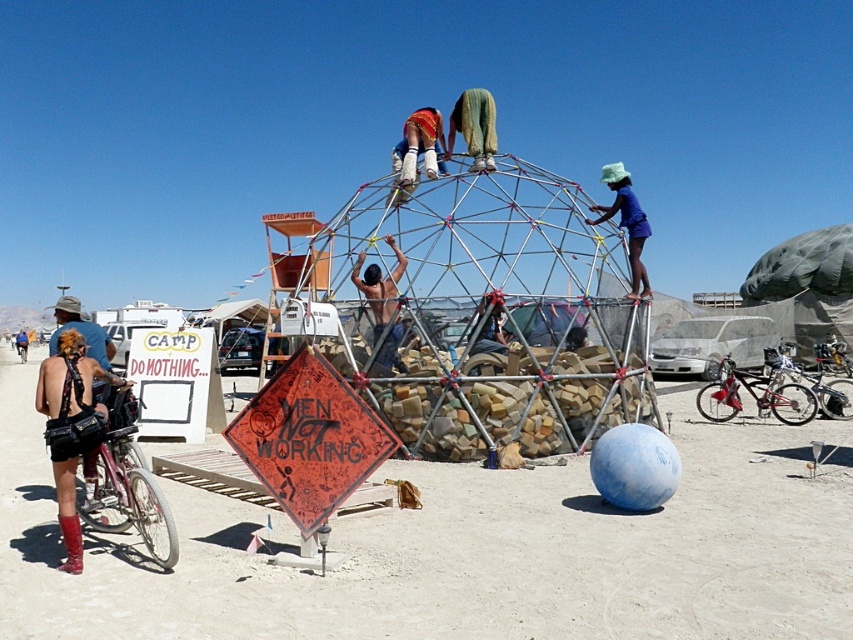
Is shiny red bicycle at lower right to the left of reddish-orange fabric pants at upper center from the viewer's perspective?

Incorrect, shiny red bicycle at lower right is not on the left side of reddish-orange fabric pants at upper center.

Does point (728, 358) come farther from viewer compared to point (415, 170)?

Yes, point (728, 358) is behind point (415, 170).

Identify the location of shiny red bicycle at lower right. This screenshot has height=640, width=853. (753, 396).

Does shiny metallic pole at center appear on the right side of blue fabric hat at upper center?

In fact, shiny metallic pole at center is to the left of blue fabric hat at upper center.

Does shiny metallic pole at center have a greater height compared to blue fabric hat at upper center?

Incorrect, shiny metallic pole at center's height is not larger of blue fabric hat at upper center's.

Find the location of a particular element. shiny metallic pole at center is located at coordinates (381, 308).

Who is more distant from viewer, (x=306, y=524) or (x=779, y=356)?

The point (x=779, y=356) is more distant.

What do you see at coordinates (309, 438) in the screenshot? This screenshot has width=853, height=640. I see `orange reflective diamond at center` at bounding box center [309, 438].

Locate an element on the screen. This screenshot has height=640, width=853. orange reflective diamond at center is located at coordinates (309, 438).